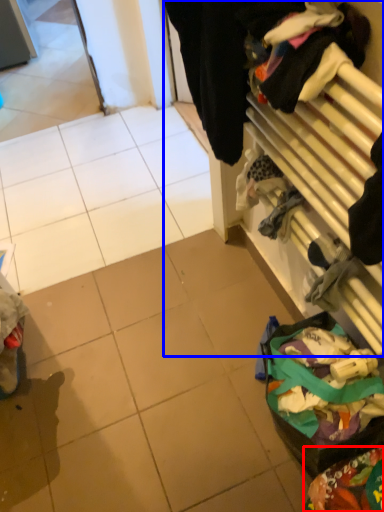
Question: Which point is further to the camera, waste (highlighted by a red box) or closet (highlighted by a blue box)?

Choices:
 (A) waste
 (B) closet

Answer: (A)